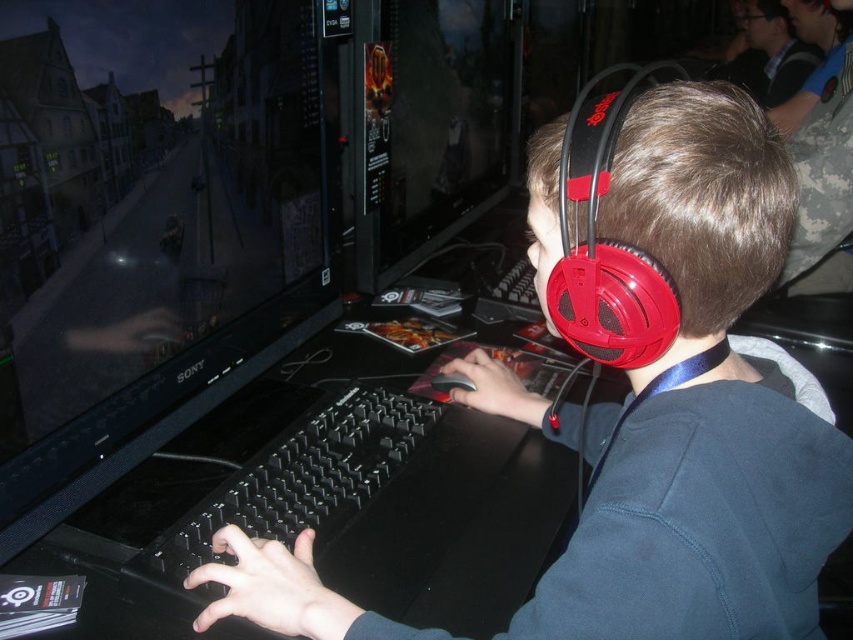
Can you confirm if red matte headphones at center is shorter than matte black monitor at center?

Indeed, red matte headphones at center has a lesser height compared to matte black monitor at center.

Is red matte headphones at center positioned behind matte black monitor at center?

No, it is not.

This screenshot has height=640, width=853. Find the location of `red matte headphones at center`. red matte headphones at center is located at coordinates (700, 404).

What are the coordinates of `red matte headphones at center` in the screenshot? It's located at click(x=700, y=404).

Who is taller, matte black monitor at upper left or matte black monitor at center?

With more height is matte black monitor at center.

Does point (175, 198) come closer to viewer compared to point (456, 218)?

That is True.

Locate an element on the screen. This screenshot has width=853, height=640. matte black monitor at upper left is located at coordinates (154, 243).

Between matte black monitor at upper left and red matte headphones at center, which one is positioned lower?

red matte headphones at center is lower down.

Is matte black monitor at upper left wider than red matte headphones at center?

Incorrect, matte black monitor at upper left's width does not surpass red matte headphones at center's.

Is point (21, 172) positioned in front of point (709, 531)?

No, it is behind (709, 531).

The image size is (853, 640). Find the location of `matte black monitor at upper left`. matte black monitor at upper left is located at coordinates (154, 243).